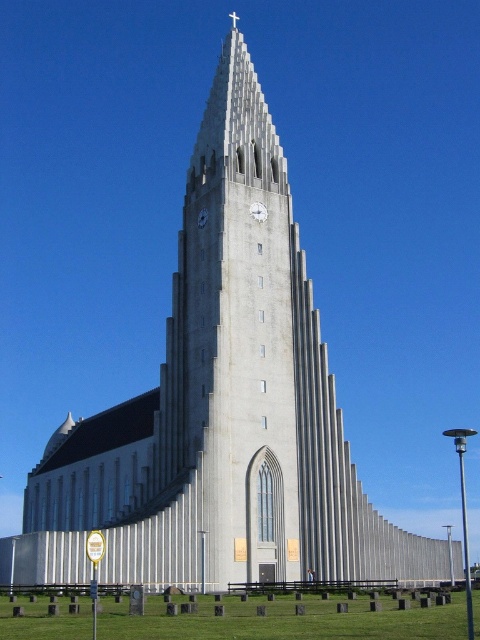
You are standing in front of the modernist church and want to determine the spatial relationship between two points marked on the structure. The first point is located at coordinates point (259, 204) and the second at point (204, 224). Based on the church design described, which point is positioned further away from you?

Point (259, 204) is behind point (204, 224), so it is further away from you.